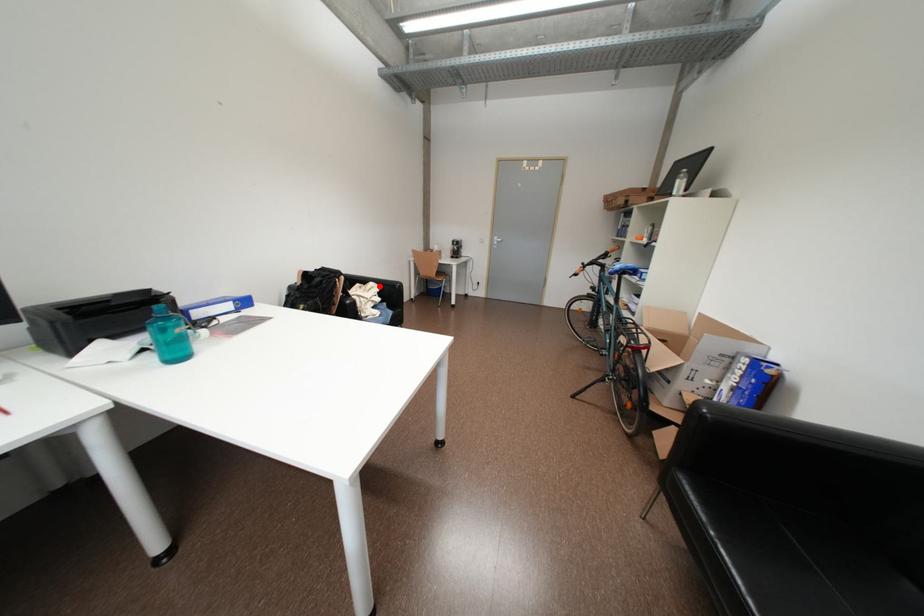
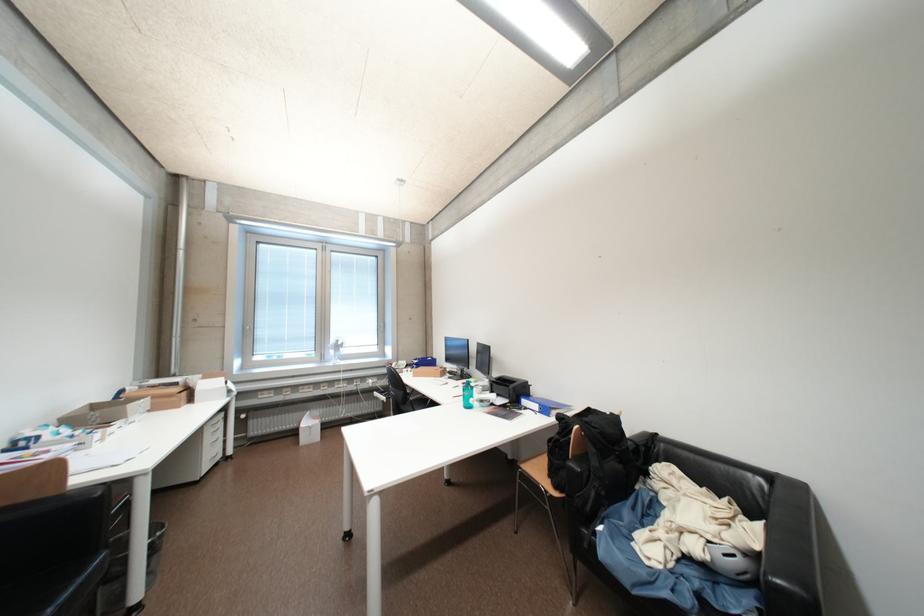
Locate, in the second image, the point that corresponds to the highlighted location in the first image.

(769, 528)